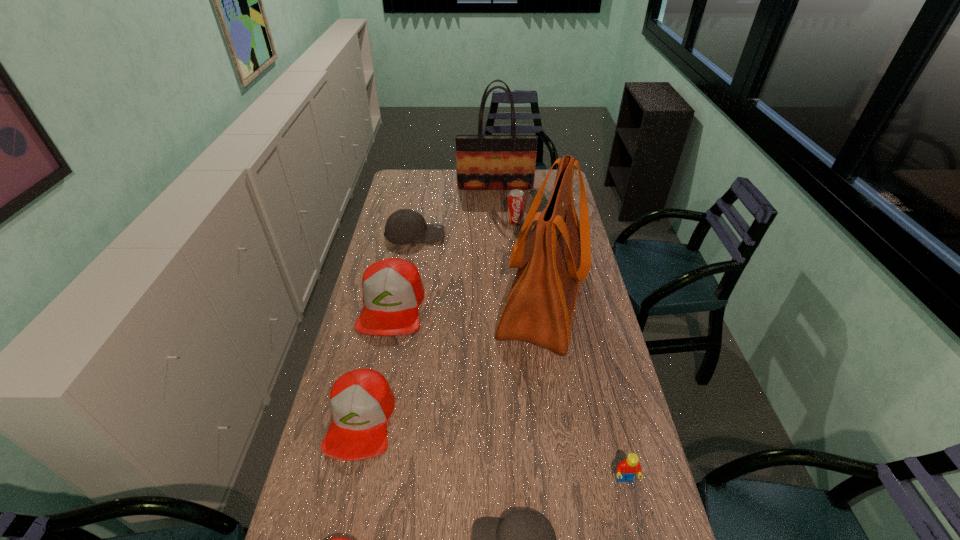
Where is `the closest object to the brown shopping bag`? The height and width of the screenshot is (540, 960). the closest object to the brown shopping bag is located at coordinates (516, 199).

Where is `baseball cap that is the third closest to the rightmost baseball cap`? baseball cap that is the third closest to the rightmost baseball cap is located at coordinates (392, 288).

Identify which baseball cap is the second nearest to the red Lego. Please provide its 2D coordinates. Your answer should be formatted as a tuple, i.e. [(x, y)], where the tuple contains the x and y coordinates of a point satisfying the conditions above.

[(337, 539)]

Choose which red baseball cap is the nearest neighbor to the red Lego. Please provide its 2D coordinates. Your answer should be formatted as a tuple, i.e. [(x, y)], where the tuple contains the x and y coordinates of a point satisfying the conditions above.

[(337, 539)]

Locate which red baseball cap ranks in proximity to the second nearest red baseball cap. Please provide its 2D coordinates. Your answer should be formatted as a tuple, i.e. [(x, y)], where the tuple contains the x and y coordinates of a point satisfying the conditions above.

[(392, 288)]

This screenshot has width=960, height=540. I want to click on vacant region that satisfies the following two spatial constraints: 1. on the logo side of the soda can; 2. on the front brim of the farthest baseball cap, so click(516, 234).

This screenshot has height=540, width=960. Identify the location of vacant space that satisfies the following two spatial constraints: 1. on the front brim of the farther gray baseball cap; 2. on the front-facing side of the second farthest baseball cap. (402, 306).

Identify the location of free space in the image that satisfies the following two spatial constraints: 1. on the front brim of the farther gray baseball cap; 2. on the front-facing side of the biggest red baseball cap. Image resolution: width=960 pixels, height=540 pixels. (402, 306).

Identify the location of vacant point that satisfies the following two spatial constraints: 1. on the logo side of the soda can; 2. on the front brim of the left gray baseball cap. (516, 234).